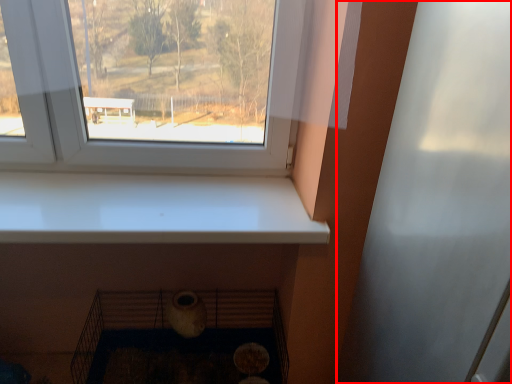
Question: From the image's perspective, what is the correct spatial relationship of screen door (annotated by the red box) in relation to shelf?

Choices:
 (A) below
 (B) above

Answer: (B)